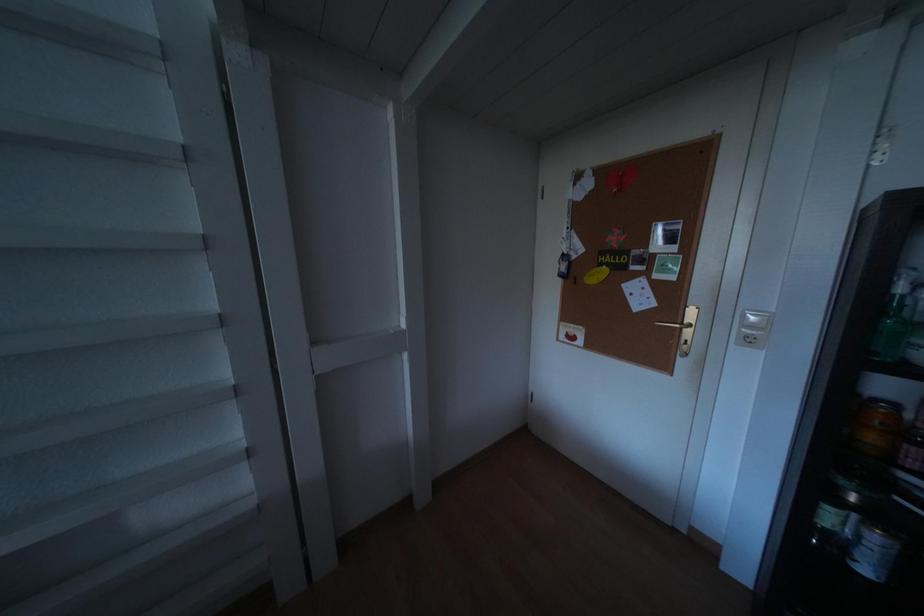
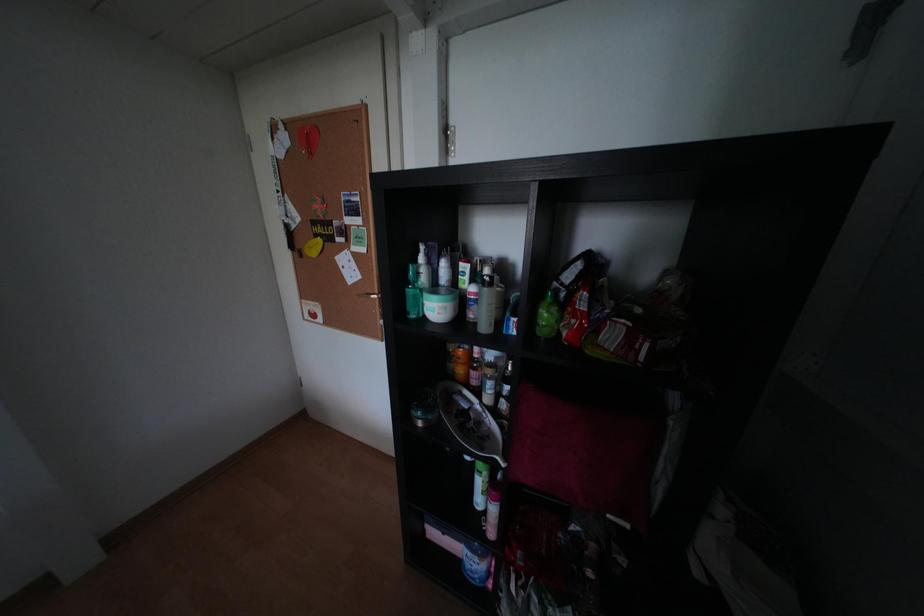
Question: The images are taken continuously from a first-person perspective. In which direction is your viewpoint rotating?

Choices:
 (A) Left
 (B) Right
 (C) Up
 (D) Down

Answer: (B)